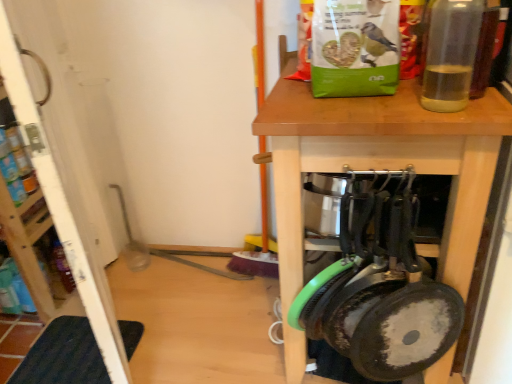
This screenshot has width=512, height=384. In order to click on vacant space situated on the left part of transparent plastic bottle at upper right in this screenshot , I will do `click(366, 112)`.